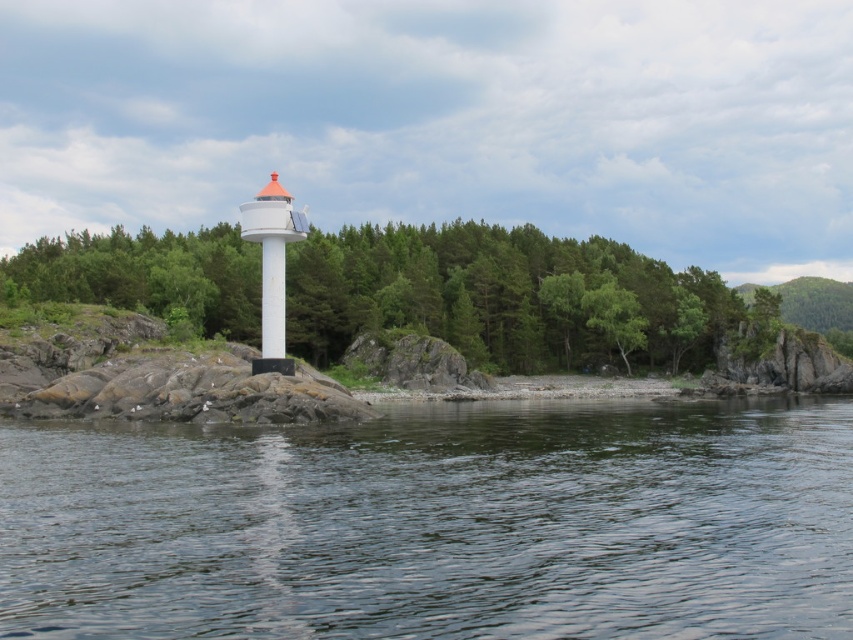
Is point (508, 412) in front of point (83, 250)?

That is True.

Who is positioned more to the right, transparent water at center or green matte tree at center?

Positioned to the right is transparent water at center.

Is point (74, 628) closer to camera compared to point (585, 284)?

Yes.

You are a GUI agent. You are given a task and a screenshot of the screen. Output one action in this format:
    pyautogui.click(x=<x>, y=<y>)
    Task: Click on the transparent water at center
    This screenshot has width=853, height=640.
    Given the screenshot: What is the action you would take?
    pyautogui.click(x=436, y=524)

Does point (582, 284) come farther from viewer compared to point (613, 305)?

Yes, point (582, 284) is farther from viewer.

Which is below, green matte tree at center or green leafy tree at center?

green leafy tree at center

Does point (312, 360) come behind point (607, 316)?

No, it is in front of (607, 316).

This screenshot has height=640, width=853. What are the coordinates of `green matte tree at center` in the screenshot? It's located at (494, 296).

Which is more to the left, transparent water at center or green leafy tree at center?

transparent water at center

Between point (492, 452) and point (621, 314), which one is positioned behind?

Point (621, 314)

Is point (735, 451) farther from viewer compared to point (621, 339)?

No, (735, 451) is in front of (621, 339).

Where is `transparent water at center`? The width and height of the screenshot is (853, 640). transparent water at center is located at coordinates (436, 524).